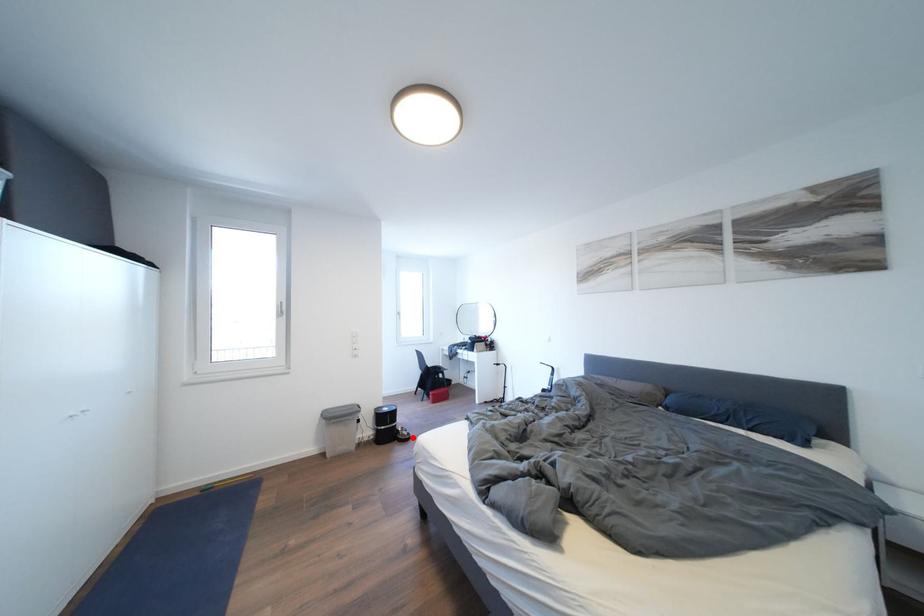
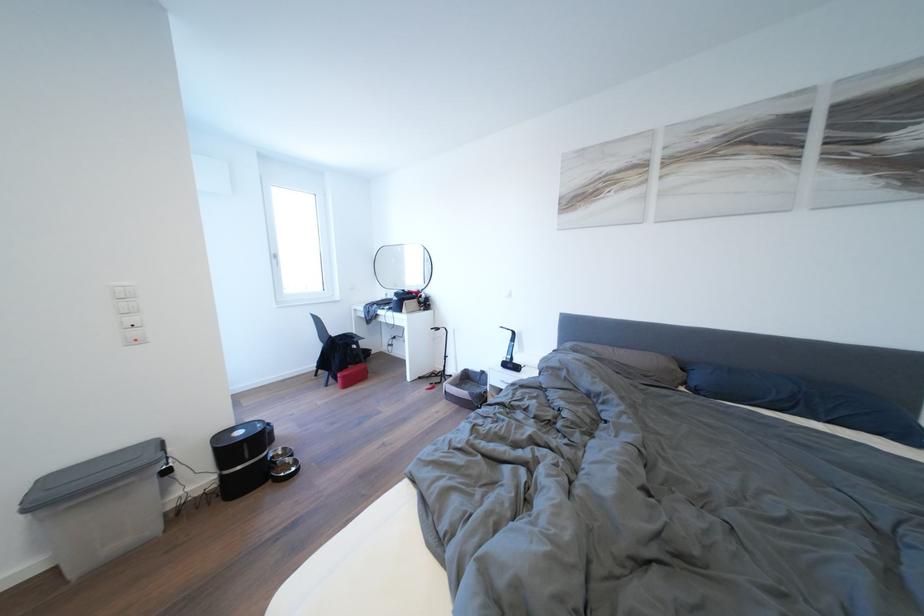
In the second image, find the point that corresponds to the highlighted location in the first image.

(296, 466)